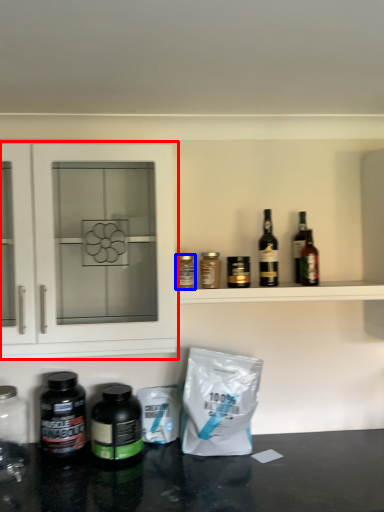
Question: Which object appears closest to the camera in this image, cabinetry (highlighted by a red box) or bottle (highlighted by a blue box)?

Choices:
 (A) cabinetry
 (B) bottle

Answer: (A)